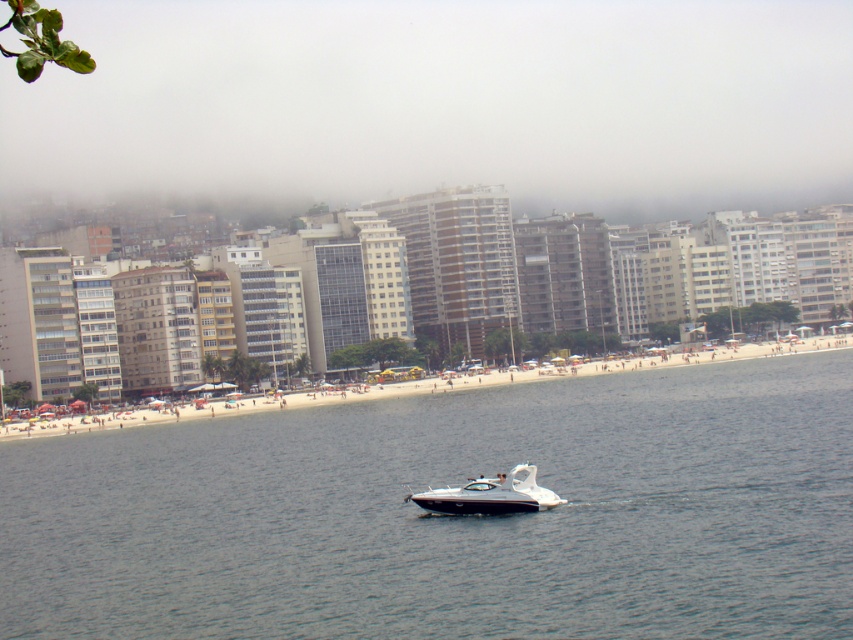
Question: Which point appears closest to the camera in this image?

Choices:
 (A) (457, 387)
 (B) (427, 492)
 (C) (322, 451)

Answer: (B)

Question: Can you confirm if clear blue water at center is thinner than white sand beach at center?

Choices:
 (A) yes
 (B) no

Answer: (A)

Question: Which object is farther from the camera taking this photo?

Choices:
 (A) clear blue water at center
 (B) white sand beach at center
 (C) white glossy speedboat at center

Answer: (B)

Question: Is white sand beach at center bigger than white glossy speedboat at center?

Choices:
 (A) yes
 (B) no

Answer: (A)

Question: Does white sand beach at center appear under white glossy speedboat at center?

Choices:
 (A) yes
 (B) no

Answer: (B)

Question: Which point is farther from the camera taking this photo?

Choices:
 (A) (508, 508)
 (B) (589, 376)
 (C) (322, 531)

Answer: (B)